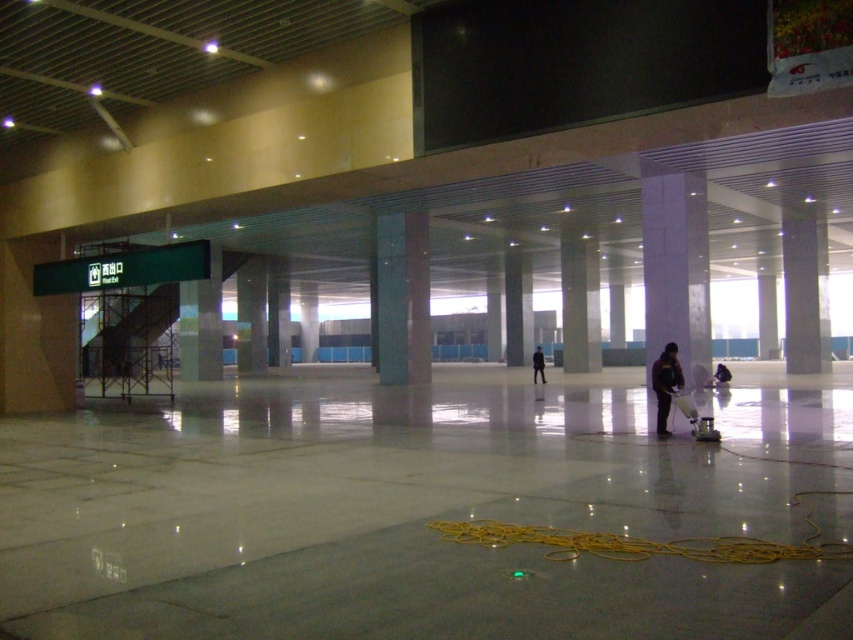
You are standing at the entrance of the construction site. You see a point marked at coordinate (665, 384). What object is located at that point?

The point at coordinate (665, 384) corresponds to the dark blue uniform at center.

You are a construction worker who just arrived at the site. You see a dark blue uniform at center and a black matte jacket at center. Which one is closer to the entrance if the entrance is on the left side of the image?

The dark blue uniform at center is to the left of the black matte jacket at center. Since the entrance is on the left side of the image, the dark blue uniform at center is closer to the entrance.